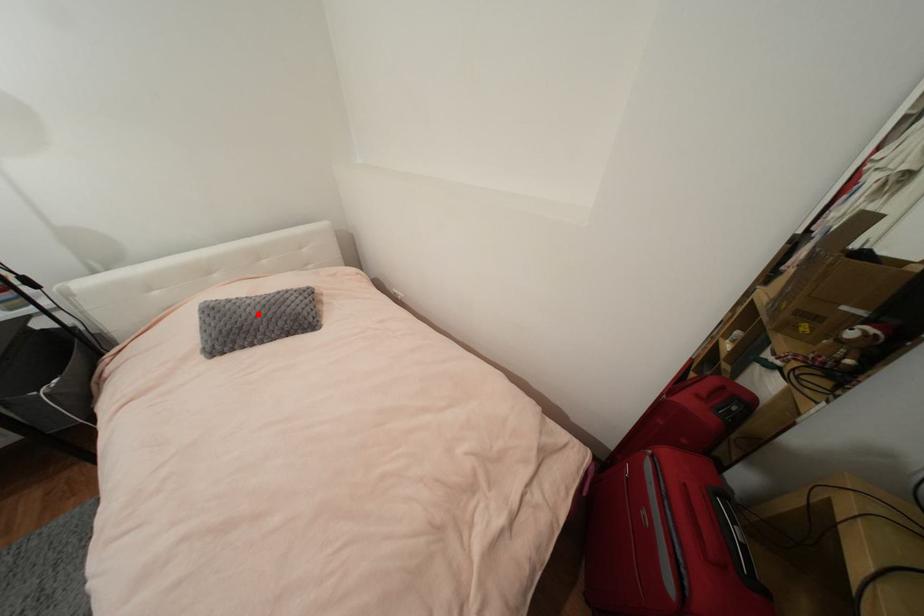
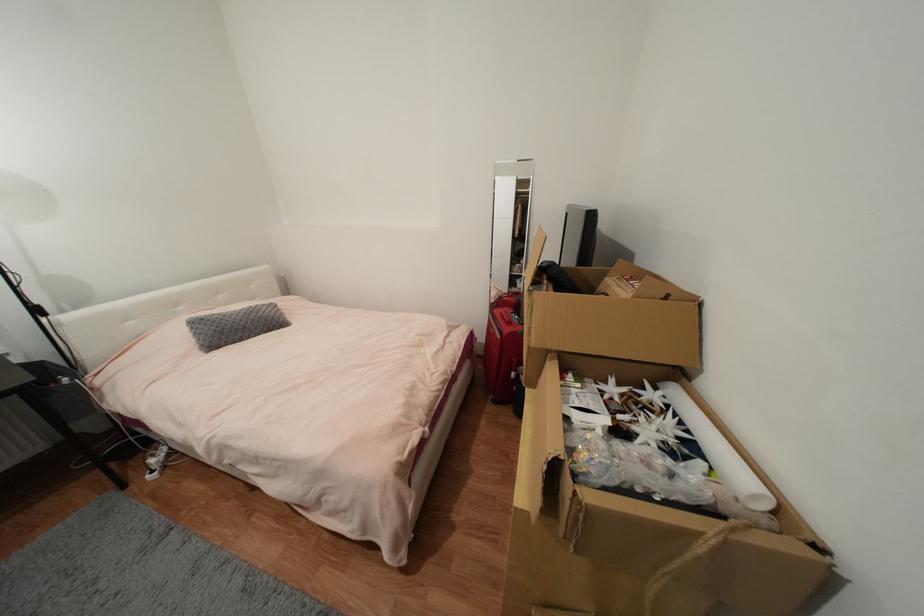
In the second image, find the point that corresponds to the highlighted location in the first image.

(244, 320)